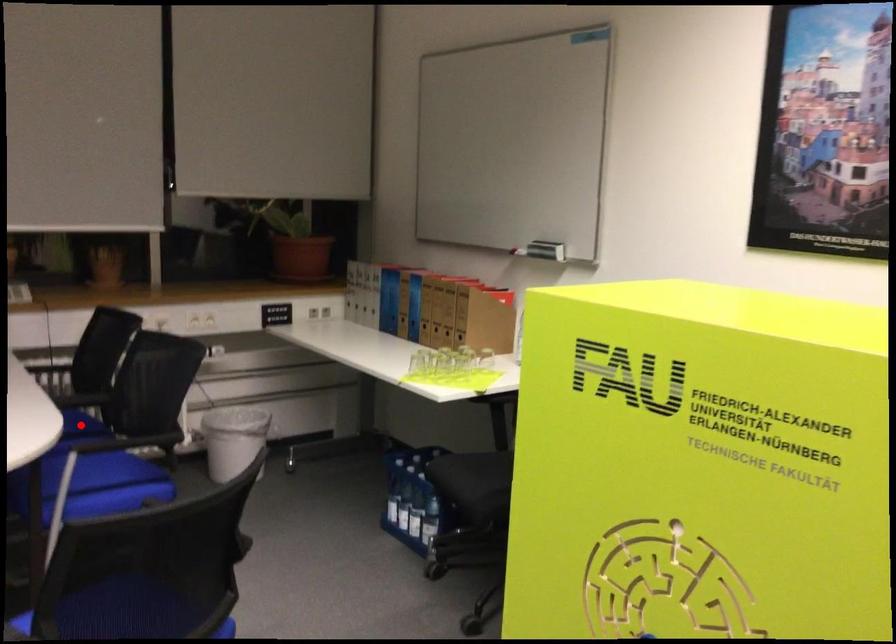
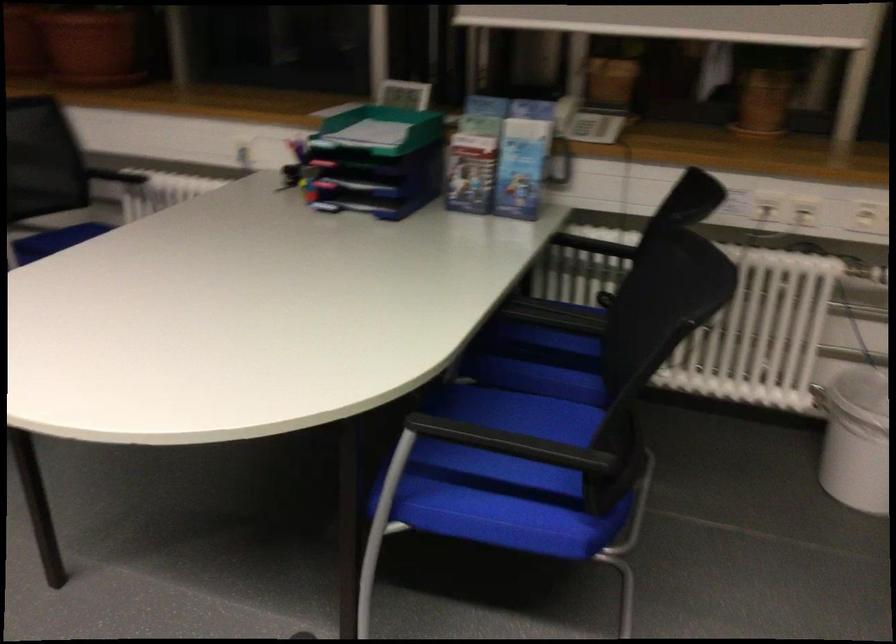
Question: I am providing you with two images of the same scene from different viewpoints. A red point is marked on the first image. At the location where the point appears in image 1, is it still visible in image 2?

Choices:
 (A) Yes
 (B) No

Answer: (B)